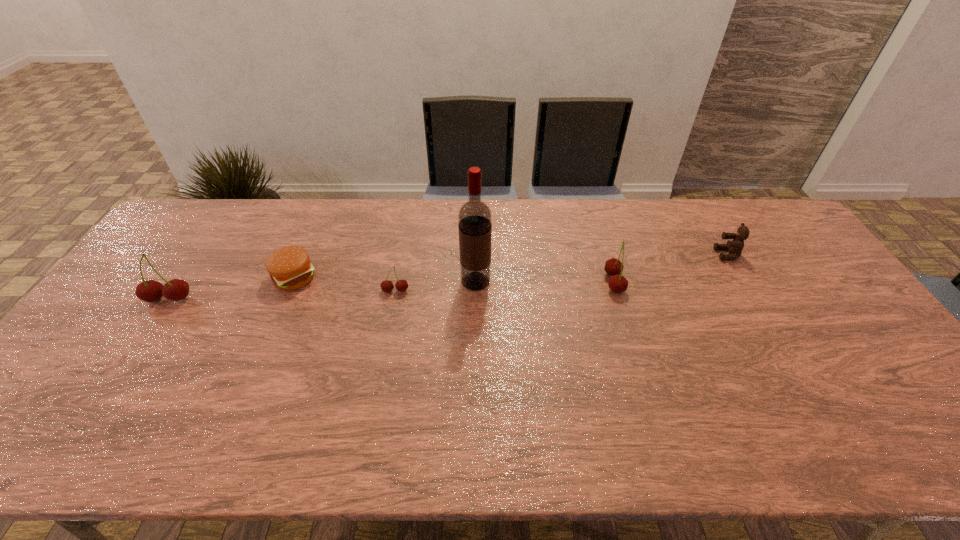
What are the coordinates of `free space between the fourth object from right to left and the fourth object from left to right` in the screenshot? It's located at (436, 286).

I want to click on free spot between the rightmost cherry and the wine bottle, so click(x=544, y=282).

Where is `vacant area between the leftmost object and the second cherry from right to left`? Image resolution: width=960 pixels, height=540 pixels. vacant area between the leftmost object and the second cherry from right to left is located at coordinates (282, 295).

Choose which object is the nearest neighbor to the rightmost object. Please provide its 2D coordinates. Your answer should be formatted as a tuple, i.e. [(x, y)], where the tuple contains the x and y coordinates of a point satisfying the conditions above.

[(613, 267)]

Locate which object ranks second in proximity to the hamburger. Please provide its 2D coordinates. Your answer should be formatted as a tuple, i.e. [(x, y)], where the tuple contains the x and y coordinates of a point satisfying the conditions above.

[(401, 285)]

Identify which cherry is the second closest to the hamburger. Please provide its 2D coordinates. Your answer should be formatted as a tuple, i.e. [(x, y)], where the tuple contains the x and y coordinates of a point satisfying the conditions above.

[(401, 285)]

The image size is (960, 540). I want to click on cherry identified as the closest to the fifth object from left to right, so click(x=401, y=285).